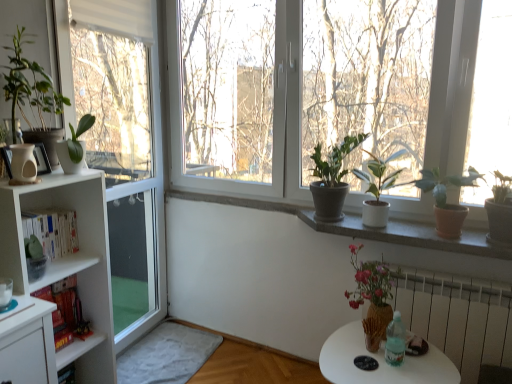
This screenshot has height=384, width=512. Identify the location of free region under white soft carpet at lower left (from a real-world perspective). (155, 360).